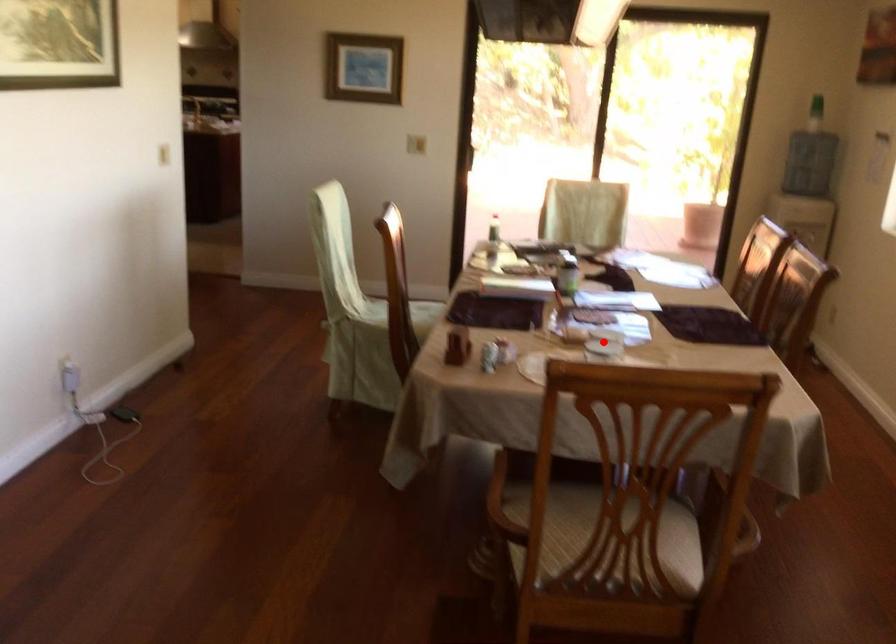
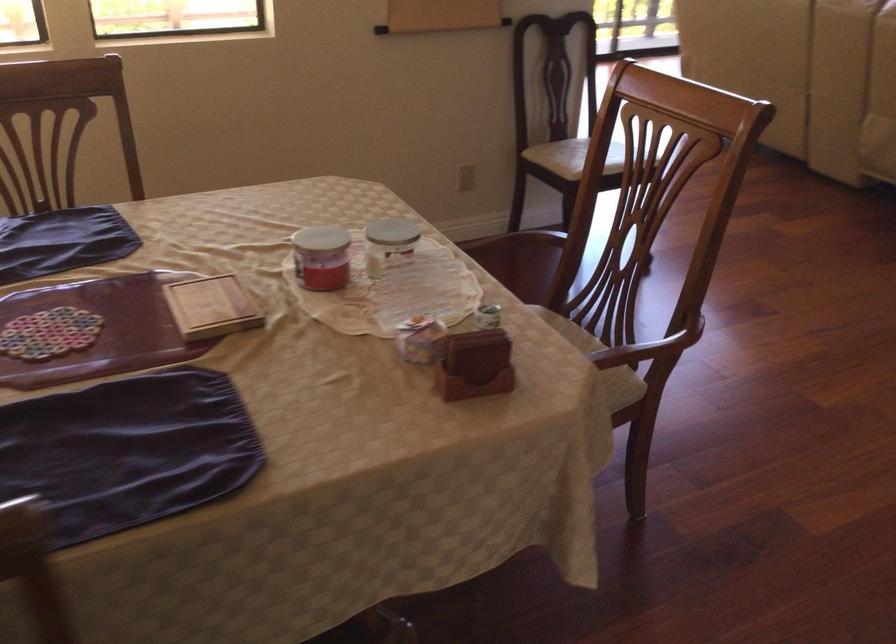
Question: I am providing you with two images of the same scene from different viewpoints. A red point is marked on the first image. At the location where the point appears in image 1, is it still visible in image 2?

Choices:
 (A) Yes
 (B) No

Answer: (A)